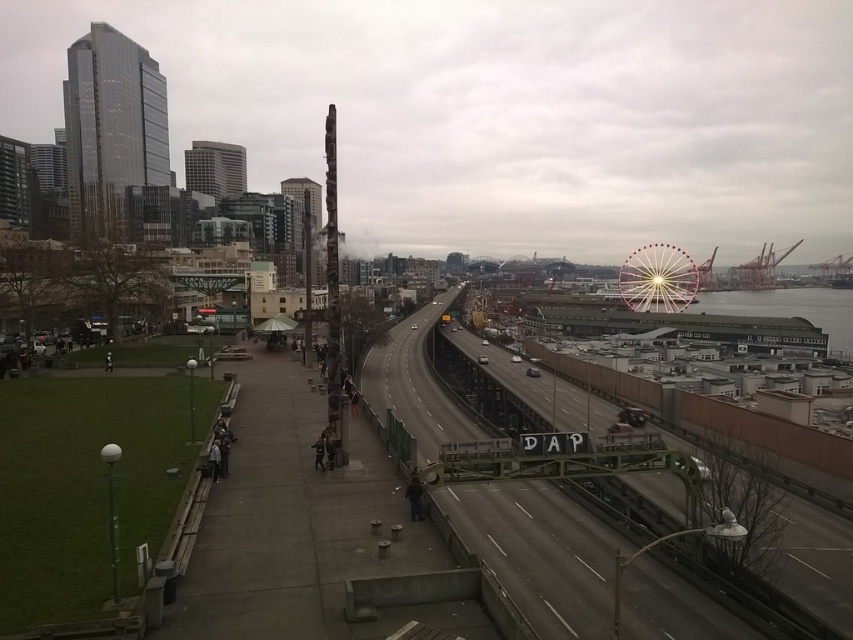
Can you confirm if metallic gray train track at center is positioned to the right of pink metallic ferris wheel at upper right?

In fact, metallic gray train track at center is to the left of pink metallic ferris wheel at upper right.

Does metallic gray train track at center have a smaller size compared to pink metallic ferris wheel at upper right?

Incorrect, metallic gray train track at center is not smaller in size than pink metallic ferris wheel at upper right.

Which is behind, point (566, 504) or point (682, 291)?

Positioned behind is point (682, 291).

Find the location of a particular element. This screenshot has height=640, width=853. metallic gray train track at center is located at coordinates (538, 554).